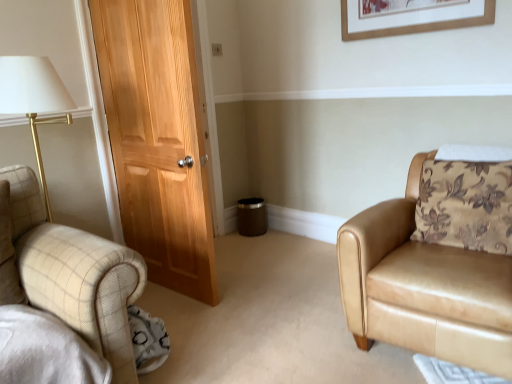
Question: Is wooden picture frame at upper center in front of or behind tan leather armchair at right in the image?

Choices:
 (A) front
 (B) behind

Answer: (B)

Question: Considering the positions of wooden picture frame at upper center and tan leather armchair at right in the image, is wooden picture frame at upper center wider or thinner than tan leather armchair at right?

Choices:
 (A) wide
 (B) thin

Answer: (B)

Question: Choose the correct answer: Is wooden picture frame at upper center inside tan leather armchair at right or outside it?

Choices:
 (A) outside
 (B) inside

Answer: (A)

Question: Do you think tan leather armchair at right is within wooden picture frame at upper center, or outside of it?

Choices:
 (A) inside
 (B) outside

Answer: (B)

Question: Considering the relative positions of tan leather armchair at right and wooden picture frame at upper center in the image provided, is tan leather armchair at right to the left or to the right of wooden picture frame at upper center?

Choices:
 (A) left
 (B) right

Answer: (B)

Question: Considering the positions of tan leather armchair at right and wooden picture frame at upper center in the image, is tan leather armchair at right wider or thinner than wooden picture frame at upper center?

Choices:
 (A) wide
 (B) thin

Answer: (A)

Question: Based on their sizes in the image, would you say tan leather armchair at right is bigger or smaller than wooden picture frame at upper center?

Choices:
 (A) small
 (B) big

Answer: (B)